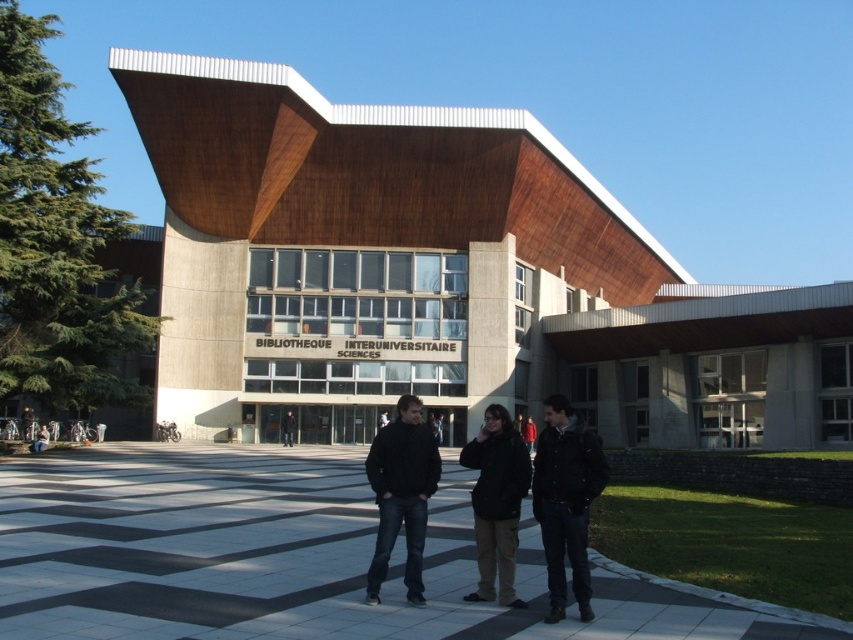
Question: Which point is farther to the camera?

Choices:
 (A) (410, 552)
 (B) (503, 406)

Answer: (B)

Question: Considering the real-world distances, which object is farthest from the dark brown leather jacket at center?

Choices:
 (A) dark blue jeans at center
 (B) black matte jacket at center

Answer: (B)

Question: Does dark blue jeans at center appear on the left side of dark brown leather jacket at center?

Choices:
 (A) no
 (B) yes

Answer: (B)

Question: Based on their relative distances, which object is nearer to the black matte jacket at center?

Choices:
 (A) dark blue jeans at center
 (B) dark brown leather jacket at center

Answer: (A)

Question: Does dark blue jeans at center have a lesser width compared to black matte jacket at center?

Choices:
 (A) no
 (B) yes

Answer: (A)

Question: Is dark blue jeans at center further to camera compared to black matte jacket at center?

Choices:
 (A) no
 (B) yes

Answer: (A)